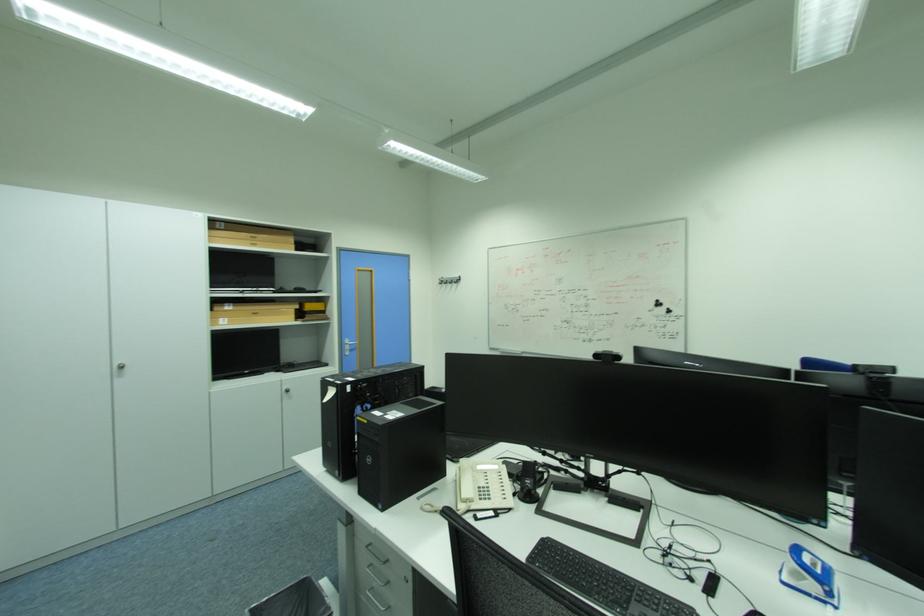
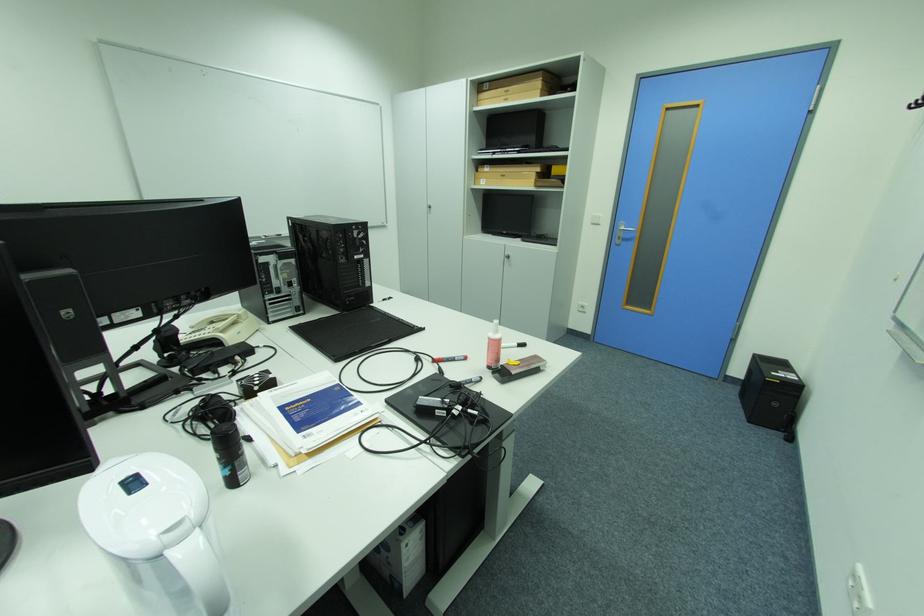
The point at (228, 320) is marked in the first image. Where is the corresponding point in the second image?

(490, 180)